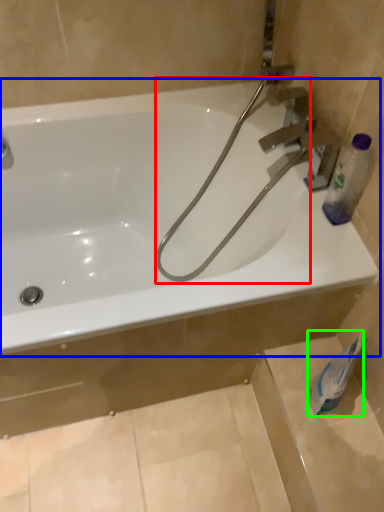
Question: Estimate the real-world distances between objects in this image. Which object is farther from garden hose (highlighted by a red box), bathtub (highlighted by a blue box) or toilet paper (highlighted by a green box)?

Choices:
 (A) bathtub
 (B) toilet paper

Answer: (B)